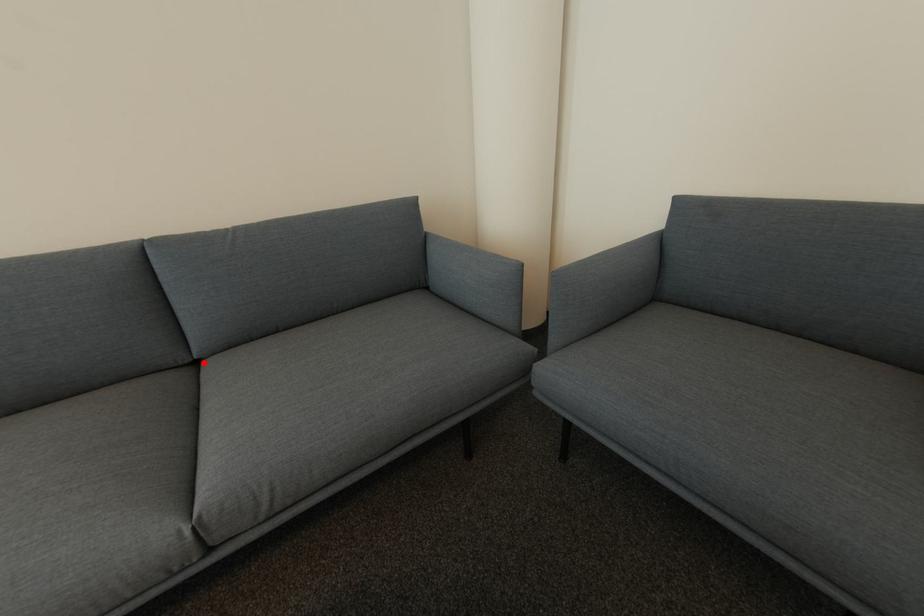
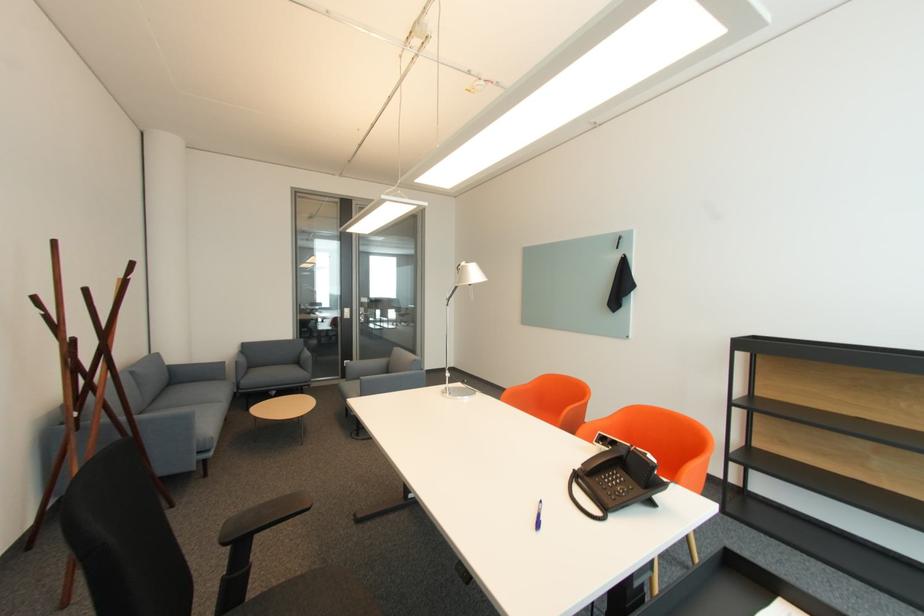
Locate, in the second image, the point that corresponds to the highlighted location in the first image.

(151, 411)